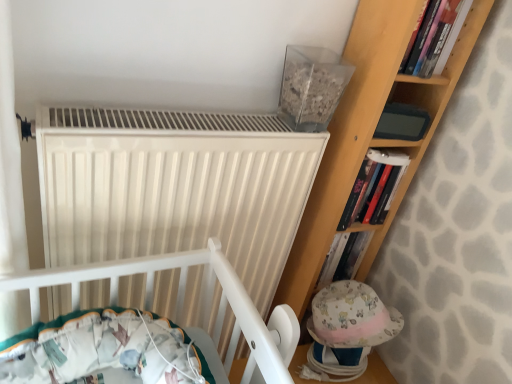
Question: Looking at their shapes, would you say white matte radiator at upper center is wider or thinner than matte gray paperback book at upper right?

Choices:
 (A) wide
 (B) thin

Answer: (A)

Question: Is white matte radiator at upper center taller or shorter than matte gray paperback book at upper right?

Choices:
 (A) short
 (B) tall

Answer: (B)

Question: Which of these objects is positioned closest to the fluffy fabric baby hat at lower right?

Choices:
 (A) matte gray paperback book at upper right
 (B) hardcover book at upper right, positioned as the second book in bottom-to-top order
 (C) hardcover book at upper right, which ranks as the first book in bottom-to-top order
 (D) white matte radiator at upper center

Answer: (C)

Question: Estimate the real-world distances between objects in this image. Which object is farther from the white matte radiator at upper center?

Choices:
 (A) hardcover book at upper right, positioned as the second book in bottom-to-top order
 (B) fluffy fabric baby hat at lower right
 (C) hardcover book at upper right, the second book from the front
 (D) matte gray paperback book at upper right

Answer: (A)